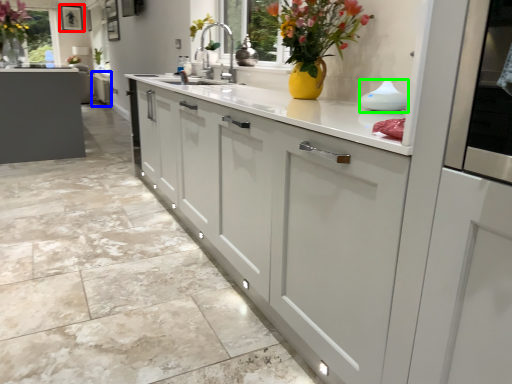
Question: Considering the real-world distances, which object is closest to picture frame (highlighted by a red box)? cabinetry (highlighted by a blue box) or appliance (highlighted by a green box).

Choices:
 (A) cabinetry
 (B) appliance

Answer: (A)